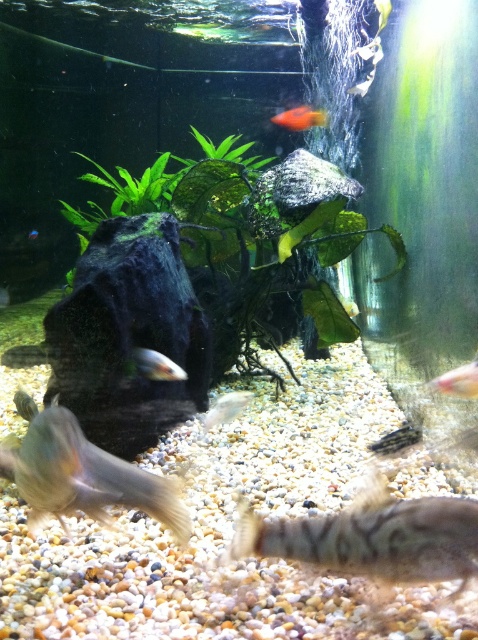
You are an aquarist trying to identify fish sizes. Which fish is bigger between the brown textured fish at bottom and the translucent yellow fish at upper right?

The brown textured fish at bottom is larger in size compared to the translucent yellow fish at upper right.

You are an aquatic biologist observing the aquarium. You need to locate the translucent yellowish fish at bottom left. Based on its coordinates, which direction should you move your gaze from the center of the aquarium to find it?

The translucent yellowish fish at bottom left is located at point (87,476). Since the coordinates are measured from the bottom left corner, a value of 0.745 on the x axis means it is 74.5 percent to the right, and 0.184 on the y axis means it is 18.4 percent up from the bottom. Therefore, to locate it, you should move your gaze to the right and slightly upward from the center of the aquarium.

Consider the image. You are a new fish in the aquarium and want to swim from the brown textured fish at bottom to the translucent yellow fish at upper right. Which direction should you swim to get closer to your destination?

To reach the translucent yellow fish at upper right from the brown textured fish at bottom, you should swim upwards and towards the right since the translucent yellow fish at upper right is positioned higher and to the right compared to the brown textured fish at bottom.